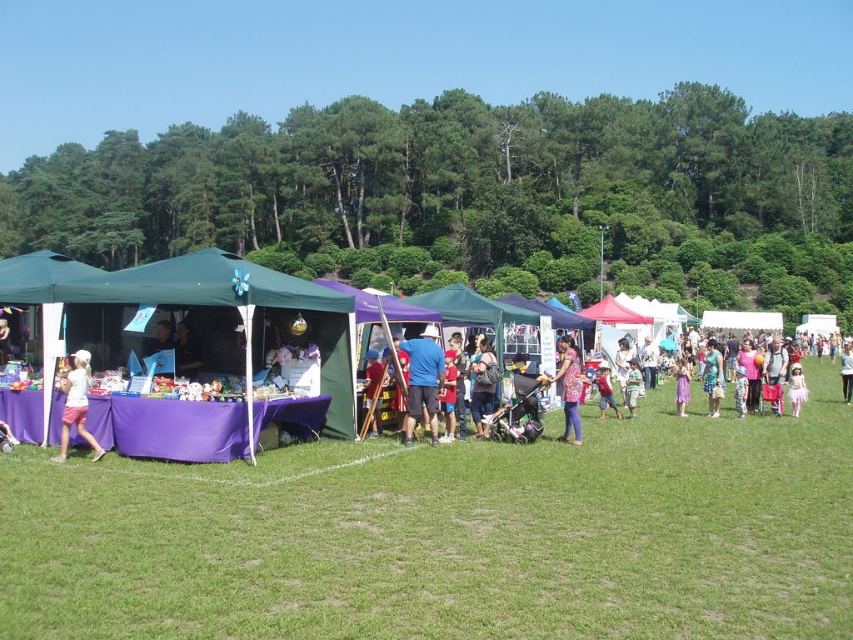
Question: Does matte blue jeans at center have a lesser width compared to green striped shirt at center?

Choices:
 (A) yes
 (B) no

Answer: (A)

Question: Among these points, which one is nearest to the camera?

Choices:
 (A) (50, 349)
 (B) (50, 285)
 (C) (606, 380)
 (D) (416, 413)

Answer: (A)

Question: Based on their relative distances, which object is nearer to the blue fabric tent at center?

Choices:
 (A) white matte dress at lower left
 (B) matte pink dress at center
 (C) purple fabric tent at left

Answer: (C)

Question: Can you confirm if blue fabric tent at center is positioned above matte blue jeans at center?

Choices:
 (A) yes
 (B) no

Answer: (B)

Question: Is matte blue jeans at center wider than green striped shirt at center?

Choices:
 (A) no
 (B) yes

Answer: (A)

Question: Which object is the closest to the blue fabric tent at center?

Choices:
 (A) matte pink dress at center
 (B) matte blue jeans at center
 (C) floral dress at center

Answer: (B)